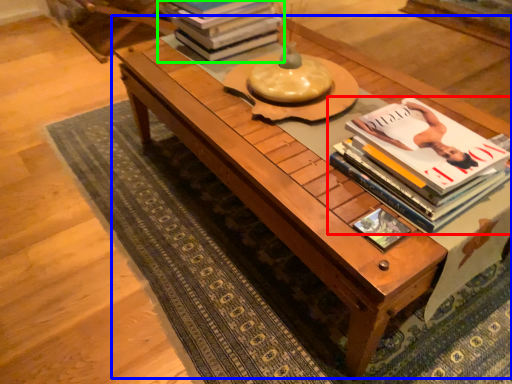
Question: Which is nearer to the book (highlighted by a red box)? table (highlighted by a blue box) or book (highlighted by a green box).

Choices:
 (A) table
 (B) book

Answer: (A)